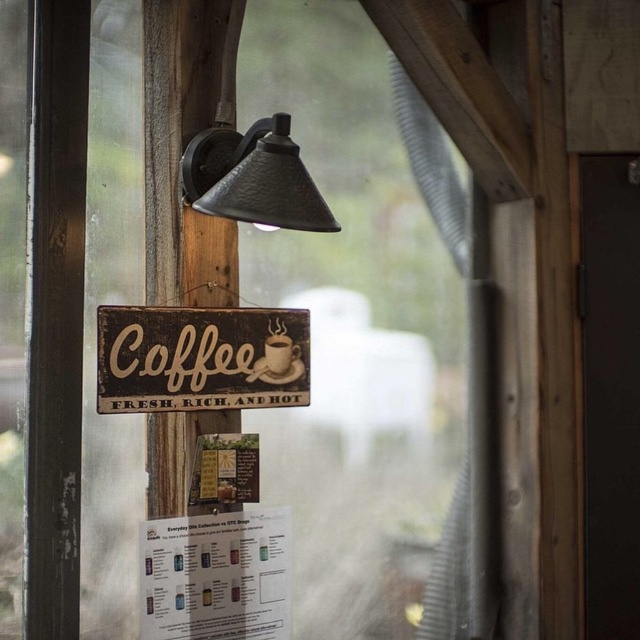
Who is taller, rustic wood sign at center or matte ceramic mug at center?

Standing taller between the two is rustic wood sign at center.

Locate an element on the screen. rustic wood sign at center is located at coordinates (200, 358).

Image resolution: width=640 pixels, height=640 pixels. I want to click on rustic wood sign at center, so click(x=200, y=358).

At what (x,y) coordinates should I click in order to perform the action: click on rustic wood sign at center. Please return your answer as a coordinate pair (x, y). Looking at the image, I should click on point(200,358).

Does rustic wood sign at center come in front of matte black lamp at upper center?

No, rustic wood sign at center is further to the viewer.

Is point (259, 337) positioned before point (285, 224)?

No, it is not.

Does point (305, 376) lie in front of point (292, 180)?

No.

The image size is (640, 640). In order to click on rustic wood sign at center in this screenshot , I will do `click(200, 358)`.

From the picture: Who is more distant from viewer, (195,157) or (282,376)?

The point (282,376) is more distant.

Is matte black lamp at upper center smaller than matte ceramic mug at center?

No.

You are a GUI agent. You are given a task and a screenshot of the screen. Output one action in this format:
    pyautogui.click(x=<x>, y=<y>)
    Task: Click on the matte black lamp at upper center
    
    Given the screenshot: What is the action you would take?
    pyautogui.click(x=253, y=177)

I want to click on matte black lamp at upper center, so click(x=253, y=177).